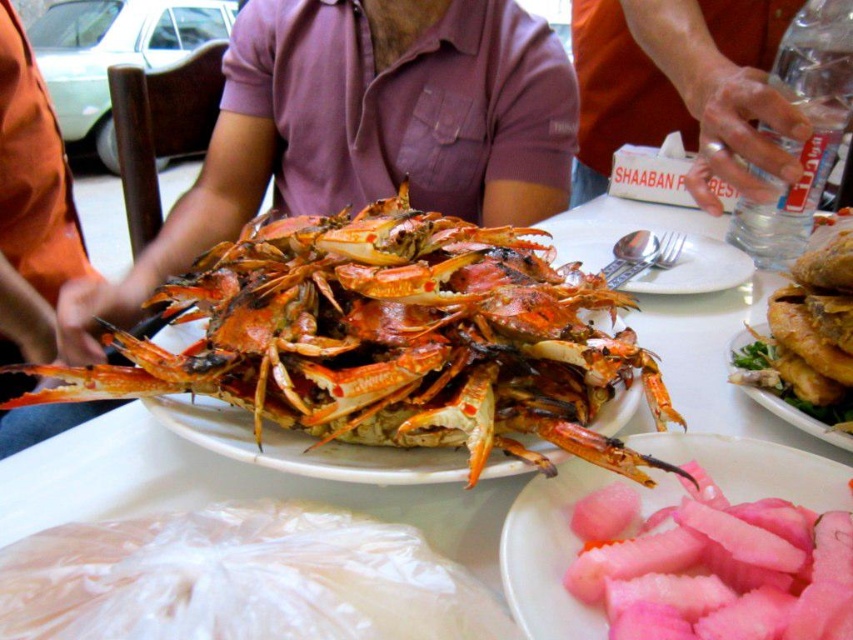
Question: Among these objects, which one is nearest to the camera?

Choices:
 (A) grilled orange lobster at center
 (B) golden crispy fried chicken at center
 (C) orange fabric hand at upper right

Answer: (A)

Question: Considering the relative positions of grilled orange lobster at center and golden crispy fried chicken at center in the image provided, where is grilled orange lobster at center located with respect to golden crispy fried chicken at center?

Choices:
 (A) below
 (B) above

Answer: (B)

Question: Can you confirm if orange fabric hand at upper right is thinner than pink translucent pickled ginger at center?

Choices:
 (A) yes
 (B) no

Answer: (B)

Question: Which point is closer to the camera?

Choices:
 (A) (457, 220)
 (B) (656, 504)

Answer: (B)

Question: Among these objects, which one is nearest to the camera?

Choices:
 (A) grilled orange lobster at center
 (B) golden crispy fried chicken at center
 (C) orange fabric hand at upper right
 (D) pink translucent pickled ginger at center

Answer: (D)

Question: From the image, what is the correct spatial relationship of grilled orange lobster at center in relation to orange fabric hand at upper right?

Choices:
 (A) below
 (B) above

Answer: (A)